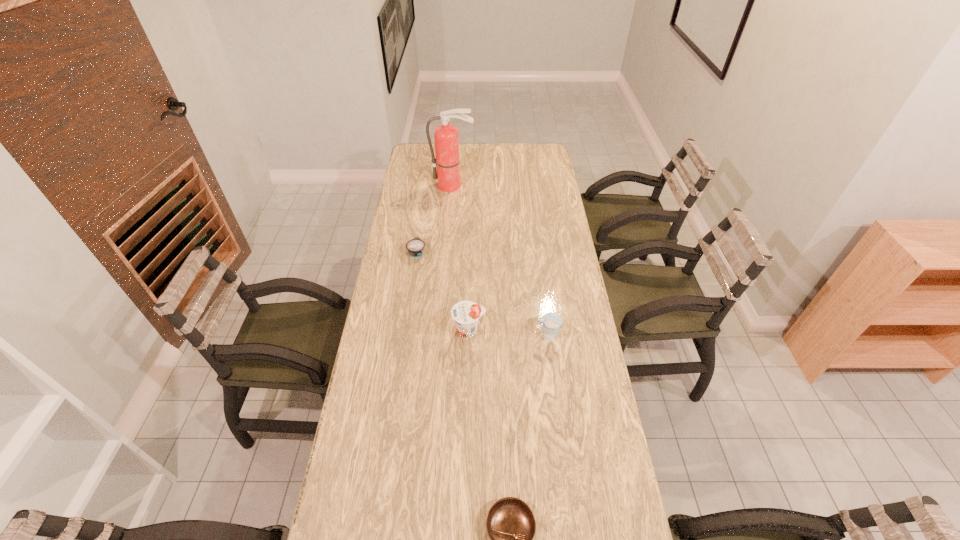
Image resolution: width=960 pixels, height=540 pixels. Identify the location of unoccupied position between the second shortest yogurt and the second farthest object. (482, 294).

The height and width of the screenshot is (540, 960). Identify the location of unoccupied position between the second shortest yogurt and the farthest yogurt. (482, 294).

The height and width of the screenshot is (540, 960). I want to click on free space between the farthest yogurt and the third shortest object, so click(482, 294).

At what (x,y) coordinates should I click in order to perform the action: click on the closest object to the third shortest object. Please return your answer as a coordinate pair (x, y). Looking at the image, I should click on (466, 314).

Identify which object is located as the fourth nearest to the farthest yogurt. Please provide its 2D coordinates. Your answer should be formatted as a tuple, i.e. [(x, y)], where the tuple contains the x and y coordinates of a point satisfying the conditions above.

[(510, 523)]

Image resolution: width=960 pixels, height=540 pixels. What are the coordinates of `the closest yogurt relative to the leftmost yogurt` in the screenshot? It's located at (466, 314).

Locate an element on the screen. The height and width of the screenshot is (540, 960). yogurt identified as the closest to the fourth shortest object is located at coordinates (551, 321).

Locate an element on the screen. The width and height of the screenshot is (960, 540). blank area in the image that satisfies the following two spatial constraints: 1. with the handle and hose on the fire extinguisher; 2. on the left side of the tallest yogurt is located at coordinates (442, 332).

Locate an element on the screen. free location that satisfies the following two spatial constraints: 1. with the handle and hose on the second tallest yogurt; 2. on the right side of the farthest object is located at coordinates (442, 336).

The image size is (960, 540). I want to click on vacant region that satisfies the following two spatial constraints: 1. on the front side of the farthest yogurt; 2. on the right side of the second yogurt from left to right, so click(405, 332).